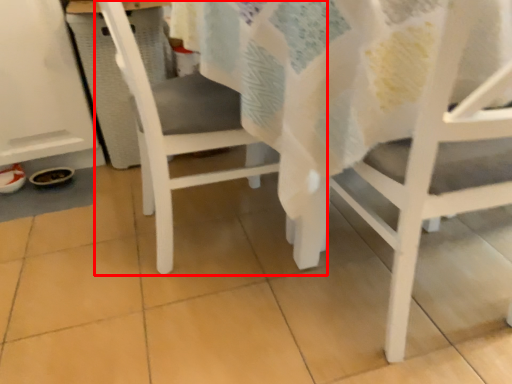
Question: From the image's perspective, what is the correct spatial positioning of chair (annotated by the red box) in reference to chair?

Choices:
 (A) above
 (B) below

Answer: (A)